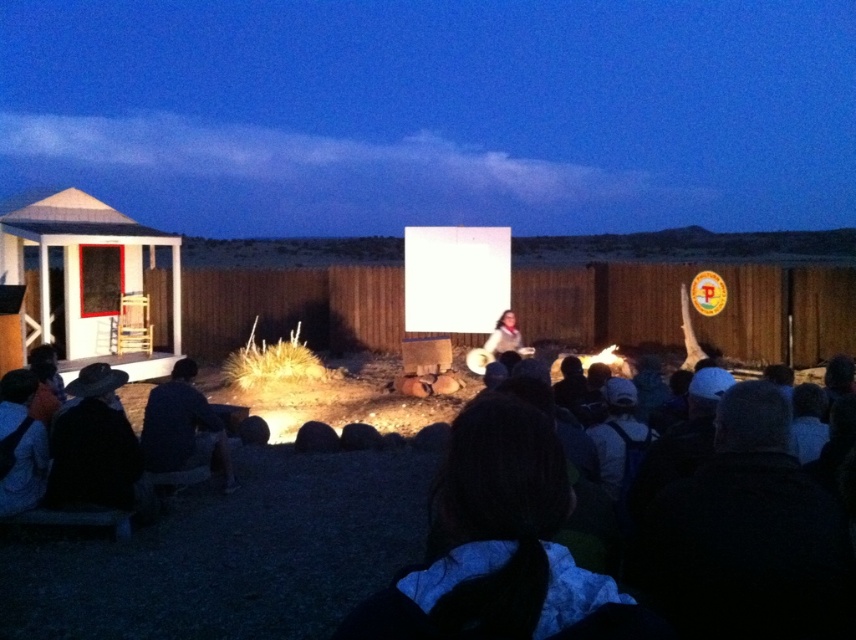
Who is positioned more to the left, dark hair at lower center or matte black jacket at center?

dark hair at lower center is more to the left.

Consider the image. Does dark hair at lower center have a greater height compared to matte black jacket at center?

No.

Is point (512, 497) farther from viewer compared to point (522, 353)?

That is False.

You are a GUI agent. You are given a task and a screenshot of the screen. Output one action in this format:
    pyautogui.click(x=<x>, y=<y>)
    Task: Click on the dark hair at lower center
    The width and height of the screenshot is (856, 640).
    Given the screenshot: What is the action you would take?
    pyautogui.click(x=491, y=540)

Can you confirm if black felt hat at lower left is bigger than dark blue fabric at lower left?

Yes.

Between black felt hat at lower left and dark blue fabric at lower left, which one is positioned lower?

black felt hat at lower left

Between point (82, 419) and point (25, 483), which one is positioned in front?

Point (82, 419) is more forward.

Where is `black felt hat at lower left`? black felt hat at lower left is located at coordinates (93, 445).

Can you confirm if dark blue fabric at lower left is positioned to the left of matte black jacket at center?

Indeed, dark blue fabric at lower left is positioned on the left side of matte black jacket at center.

Is point (39, 484) positioned after point (512, 348)?

No, (39, 484) is in front of (512, 348).

In order to click on dark blue fabric at lower left in this screenshot , I will do `click(21, 444)`.

Find the location of a particular element. dark blue fabric at lower left is located at coordinates (21, 444).